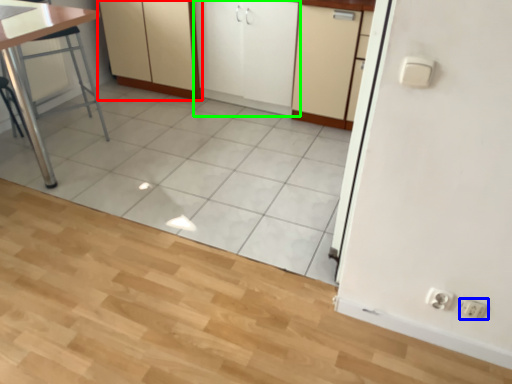
Question: Which object is the closest to the cabinetry (highlighted by a red box)? Choose among these: electric outlet (highlighted by a blue box) or cabinetry (highlighted by a green box).

Choices:
 (A) electric outlet
 (B) cabinetry

Answer: (B)